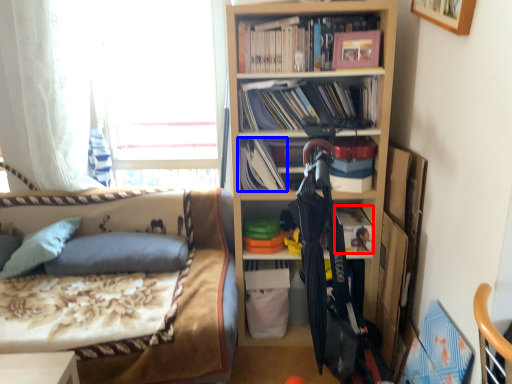
Question: Which object is further to the camera taking this photo, book (highlighted by a red box) or book (highlighted by a blue box)?

Choices:
 (A) book
 (B) book

Answer: (A)